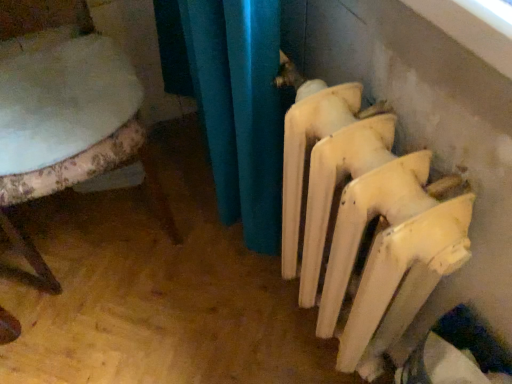
Image resolution: width=512 pixels, height=384 pixels. Identify the location of vacant region below white matte radiator at lower right (from a real-world perspective). (301, 326).